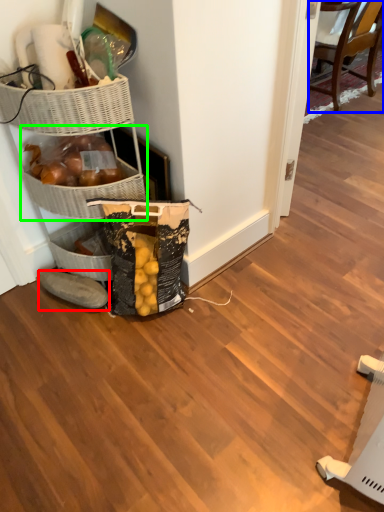
Question: Which object is positioned farthest from footwear (highlighted by a red box)? Select from chair (highlighted by a blue box) and basket (highlighted by a green box).

Choices:
 (A) chair
 (B) basket

Answer: (A)